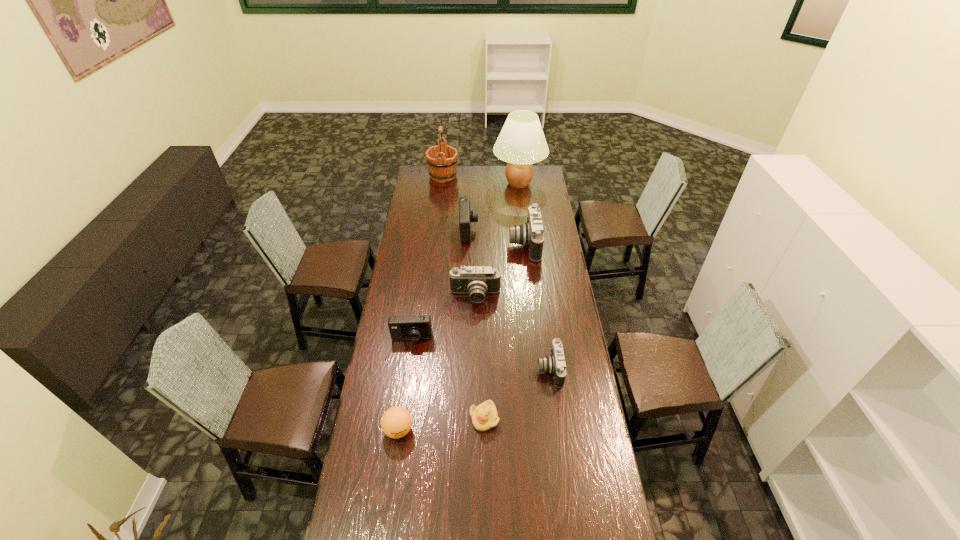
At what (x,y) coordinates should I click in order to perform the action: click on lampshade. Please return your answer as a coordinate pair (x, y). The image size is (960, 540). Looking at the image, I should click on (521, 142).

You are a GUI agent. You are given a task and a screenshot of the screen. Output one action in this format:
    pyautogui.click(x=<x>, y=<y>)
    Task: Click on the beige lampshade
    
    Given the screenshot: What is the action you would take?
    pyautogui.click(x=521, y=142)

The width and height of the screenshot is (960, 540). I want to click on the eighth shortest object, so click(x=442, y=159).

Find the location of a particular element. wood wine bucket is located at coordinates (442, 159).

You are a GUI agent. You are given a task and a screenshot of the screen. Output one action in this format:
    pyautogui.click(x=<x>, y=<y>)
    Task: Click on the seventh shortest object
    This screenshot has height=540, width=960.
    Given the screenshot: What is the action you would take?
    click(530, 234)

You are a GUI agent. You are given a task and a screenshot of the screen. Output one action in this format:
    pyautogui.click(x=<x>, y=<y>)
    Task: Click on the farthest black camera
    
    Given the screenshot: What is the action you would take?
    pyautogui.click(x=530, y=234)

The image size is (960, 540). What are the coordinates of `the farther blue camera` in the screenshot? It's located at (466, 216).

You are a GUI agent. You are given a task and a screenshot of the screen. Output one action in this format:
    pyautogui.click(x=<x>, y=<y>)
    Task: Click on the right blue camera
    
    Given the screenshot: What is the action you would take?
    pyautogui.click(x=466, y=216)

Where is `the second smallest black camera`? the second smallest black camera is located at coordinates [476, 280].

Identify the location of the fifth nearest object. (476, 280).